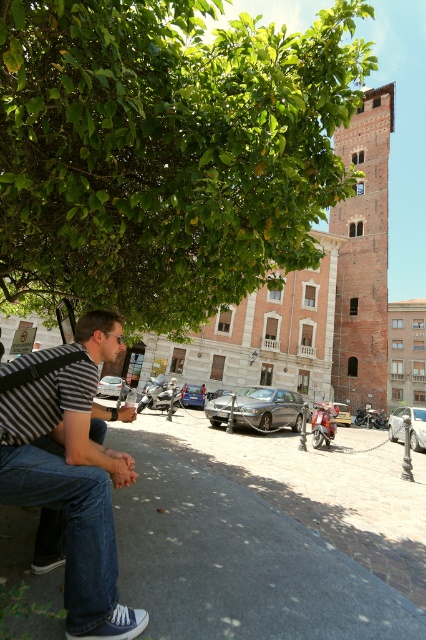
You are standing in the town square and want to take a photo of both the man on the low stone bench and the tall tower of the historic building. Which point, point [94,632] or point [382,259], is better to focus on to ensure both subjects are in clear view?

Point [94,632] is closer to the viewer than point [382,259], so focusing on point [94,632] will ensure both the man on the low stone bench and the tall tower of the historic building are in clear view.